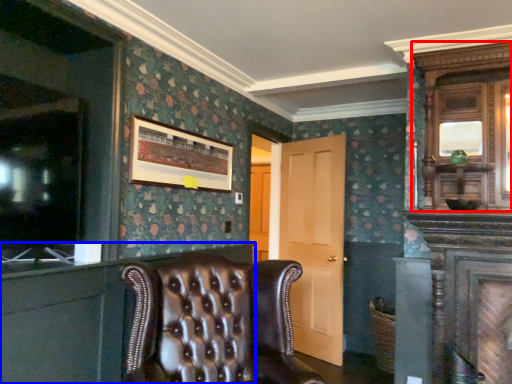
Question: Which object is closer to the camera taking this photo, armoire (highlighted by a red box) or dresser (highlighted by a blue box)?

Choices:
 (A) armoire
 (B) dresser

Answer: (B)